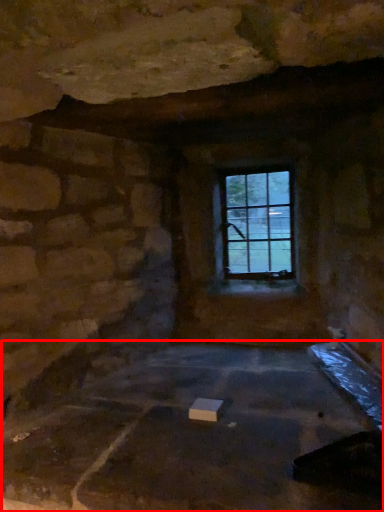
Question: From the image's perspective, where is foundation (annotated by the red box) located in relation to window in the image?

Choices:
 (A) below
 (B) above

Answer: (A)